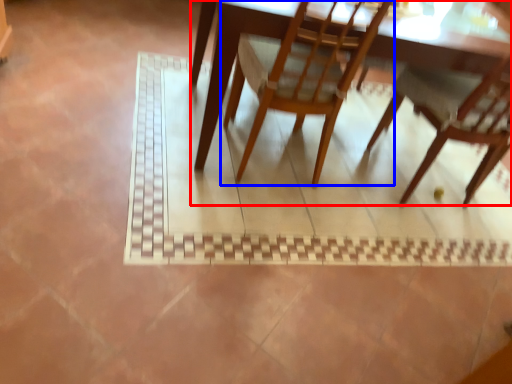
Question: Which of the following is the closest to the observer, table (highlighted by a red box) or chair (highlighted by a blue box)?

Choices:
 (A) table
 (B) chair

Answer: (B)